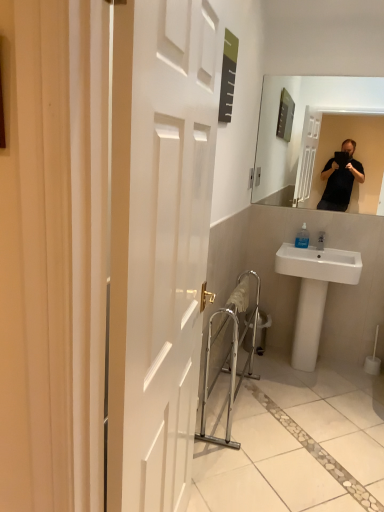
Question: Is silver metallic balustrade at lower center inside the boundaries of white ceramic sink at lower right, or outside?

Choices:
 (A) inside
 (B) outside

Answer: (B)

Question: Visually, is silver metallic balustrade at lower center positioned to the left or to the right of white ceramic sink at lower right?

Choices:
 (A) right
 (B) left

Answer: (B)

Question: Estimate the real-world distances between objects in this image. Which object is farther from the silver metallic balustrade at lower center?

Choices:
 (A) metallic silver trash can at center
 (B) white ceramic sink at lower right
 (C) transparent plastic soap dispenser at sink

Answer: (C)

Question: Considering the real-world distances, which object is farthest from the transparent plastic soap dispenser at sink?

Choices:
 (A) silver metallic balustrade at lower center
 (B) metallic silver trash can at center
 (C) white ceramic sink at lower right

Answer: (A)